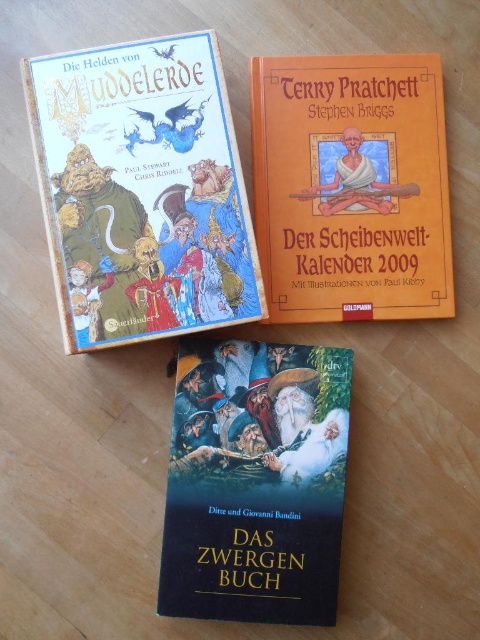
You are organizing books on a shelf and want to place the matte paper book at upper left and the dark blue matte book at center. Which book should you place first if you want to arrange them from closest to farthest from the viewer?

You should place the matte paper book at upper left first because it is closer to the viewer than the dark blue matte book at center.

You are organizing books on a shelf and see the matte paper book at upper left and the brown leather book at upper center. Which book should you move to the right side of the shelf to make space for a new book on the left?

You should move the brown leather book at upper center to the right side of the shelf because the matte paper book at upper left is already positioned to its left. This will free up space on the left for the new book.